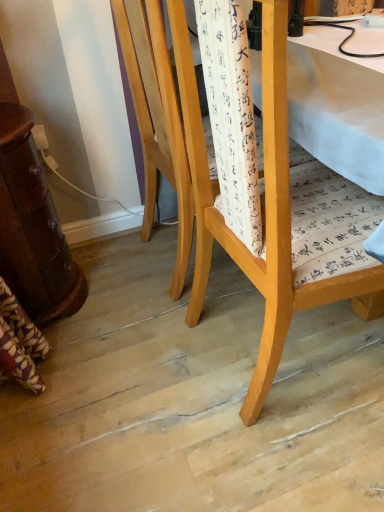
Find the location of a particular element. The width and height of the screenshot is (384, 512). light wood chair at center, the 2th chair positioned from the front is located at coordinates (157, 120).

This screenshot has width=384, height=512. Describe the element at coordinates (157, 120) in the screenshot. I see `light wood chair at center, the 2th chair positioned from the front` at that location.

The width and height of the screenshot is (384, 512). What do you see at coordinates (265, 209) in the screenshot?
I see `light wood chair at center, the 2th chair viewed from the back` at bounding box center [265, 209].

Measure the distance between point [281,99] and camera.

A distance of 24.33 inches exists between point [281,99] and camera.

Based on the photo, what is the approximate width of light wood chair at center, the 1th chair from the front?

48.41 centimeters.

At what (x,y) coordinates should I click in order to perform the action: click on light wood chair at center, the 2th chair viewed from the back. Please return your answer as a coordinate pair (x, y). The image size is (384, 512). Looking at the image, I should click on (265, 209).

This screenshot has height=512, width=384. Find the location of `light wood chair at center, which is the 1th chair from back to front`. light wood chair at center, which is the 1th chair from back to front is located at coordinates (157, 120).

Which object is positioned more to the right, light wood chair at center, the 2th chair positioned from the front, or light wood chair at center, the 2th chair viewed from the back?

Positioned to the right is light wood chair at center, the 2th chair viewed from the back.

In the scene shown: In the image, is light wood chair at center, which is the 1th chair from back to front, positioned in front of or behind light wood chair at center, the 2th chair viewed from the back?

Visually, light wood chair at center, which is the 1th chair from back to front, is located behind light wood chair at center, the 2th chair viewed from the back.

Which is closer, (139, 76) or (333, 298)?

Clearly, point (139, 76) is more distant from the camera than point (333, 298).

From the image's perspective, is light wood chair at center, which is the 1th chair from back to front, located above light wood chair at center, the 2th chair viewed from the back?

Yes, from the image's perspective, light wood chair at center, which is the 1th chair from back to front, is on top of light wood chair at center, the 2th chair viewed from the back.

In the scene shown: From a real-world perspective, between light wood chair at center, the 2th chair positioned from the front, and light wood chair at center, the 1th chair from the front, who is vertically lower?

In real-world perspective, light wood chair at center, the 2th chair positioned from the front, is lower.

Considering the sizes of objects light wood chair at center, which is the 1th chair from back to front, and light wood chair at center, the 1th chair from the front, in the image provided, who is thinner, light wood chair at center, which is the 1th chair from back to front, or light wood chair at center, the 1th chair from the front,?

light wood chair at center, the 1th chair from the front.

Is light wood chair at center, the 2th chair positioned from the front, shorter than light wood chair at center, the 2th chair viewed from the back?

Correct, light wood chair at center, the 2th chair positioned from the front, is not as tall as light wood chair at center, the 2th chair viewed from the back.

Considering the relative sizes of light wood chair at center, the 2th chair positioned from the front, and light wood chair at center, the 1th chair from the front, in the image provided, is light wood chair at center, the 2th chair positioned from the front, smaller than light wood chair at center, the 1th chair from the front,?

No, light wood chair at center, the 2th chair positioned from the front, is not smaller than light wood chair at center, the 1th chair from the front.

Is light wood chair at center, which is the 1th chair from back to front, completely or partially outside of light wood chair at center, the 1th chair from the front?

That's correct, light wood chair at center, which is the 1th chair from back to front, is outside of light wood chair at center, the 1th chair from the front.

Is light wood chair at center, which is the 1th chair from back to front, turned away from light wood chair at center, the 1th chair from the front?

light wood chair at center, which is the 1th chair from back to front, is not turned away from light wood chair at center, the 1th chair from the front.

Can you tell me how much light wood chair at center, the 2th chair positioned from the front, and light wood chair at center, the 1th chair from the front, differ in facing direction?

The angle between the facing direction of light wood chair at center, the 2th chair positioned from the front, and the facing direction of light wood chair at center, the 1th chair from the front, is 1.67 degrees.

What are the coordinates of `chair that appears below the light wood chair at center, which is the 1th chair from back to front (from the image's perspective)` in the screenshot? It's located at (265, 209).

Considering the relative positions of light wood chair at center, the 2th chair viewed from the back, and light wood chair at center, the 2th chair positioned from the front, in the image provided, is light wood chair at center, the 2th chair viewed from the back, to the left of light wood chair at center, the 2th chair positioned from the front, from the viewer's perspective?

Incorrect, light wood chair at center, the 2th chair viewed from the back, is not on the left side of light wood chair at center, the 2th chair positioned from the front.

Considering the positions of objects light wood chair at center, the 1th chair from the front, and light wood chair at center, which is the 1th chair from back to front, in the image provided, who is behind, light wood chair at center, the 1th chair from the front, or light wood chair at center, which is the 1th chair from back to front,?

light wood chair at center, which is the 1th chair from back to front, is behind.

Which is in front, point (263, 66) or point (152, 129)?

The point (263, 66) is closer to the camera.

From the image's perspective, which object appears higher, light wood chair at center, the 1th chair from the front, or light wood chair at center, which is the 1th chair from back to front?

light wood chair at center, which is the 1th chair from back to front, appears higher in the image.

From a real-world perspective, who is located higher, light wood chair at center, the 1th chair from the front, or light wood chair at center, the 2th chair positioned from the front?

light wood chair at center, the 1th chair from the front, from a real-world perspective.

Looking at their sizes, would you say light wood chair at center, the 1th chair from the front, is wider or thinner than light wood chair at center, the 2th chair positioned from the front?

light wood chair at center, the 1th chair from the front, is thinner than light wood chair at center, the 2th chair positioned from the front.

Is light wood chair at center, the 1th chair from the front, taller or shorter than light wood chair at center, which is the 1th chair from back to front?

In the image, light wood chair at center, the 1th chair from the front, appears to be taller than light wood chair at center, which is the 1th chair from back to front.

Is light wood chair at center, the 2th chair viewed from the back, bigger than light wood chair at center, which is the 1th chair from back to front?

Actually, light wood chair at center, the 2th chair viewed from the back, might be smaller than light wood chair at center, which is the 1th chair from back to front.

Does light wood chair at center, the 2th chair viewed from the back, contain light wood chair at center, the 2th chair positioned from the front?

Actually, light wood chair at center, the 2th chair positioned from the front, is outside light wood chair at center, the 2th chair viewed from the back.

Is light wood chair at center, the 2th chair viewed from the back, beside light wood chair at center, the 2th chair positioned from the front?

There is a gap between light wood chair at center, the 2th chair viewed from the back, and light wood chair at center, the 2th chair positioned from the front.

Is light wood chair at center, the 2th chair viewed from the back, aimed at light wood chair at center, which is the 1th chair from back to front?

No, light wood chair at center, the 2th chair viewed from the back, is not facing towards light wood chair at center, which is the 1th chair from back to front.

Find the location of a particular element. This screenshot has height=512, width=384. chair in front of the light wood chair at center, the 2th chair positioned from the front is located at coordinates (265, 209).

This screenshot has width=384, height=512. What are the coordinates of `chair below the light wood chair at center, the 2th chair viewed from the back (from a real-world perspective)` in the screenshot? It's located at tap(157, 120).

Where is `chair that is in front of the light wood chair at center, which is the 1th chair from back to front`? The image size is (384, 512). chair that is in front of the light wood chair at center, which is the 1th chair from back to front is located at coordinates (265, 209).